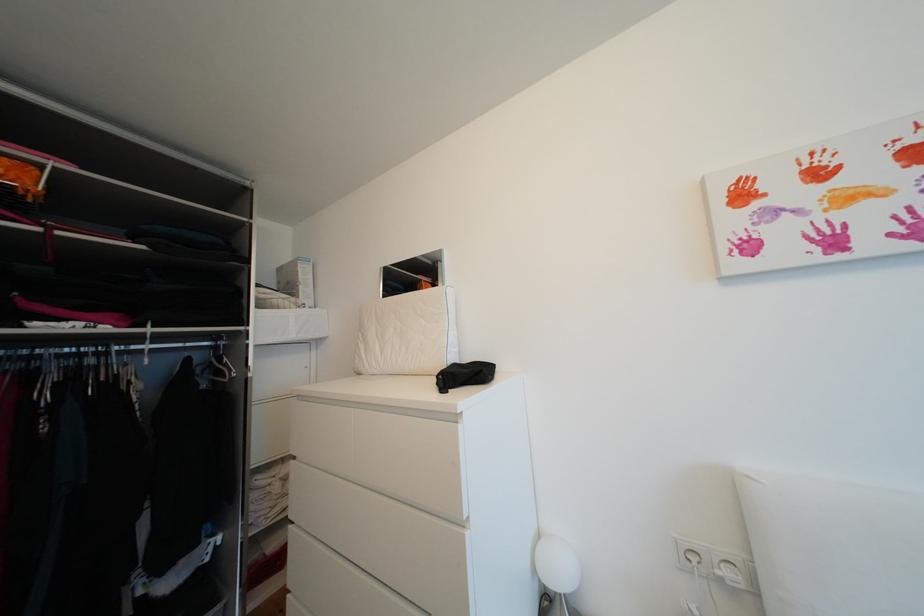
Find where to pull the white drawer handle. Please return your answer as a coordinate pair (x, y).

(338, 583)